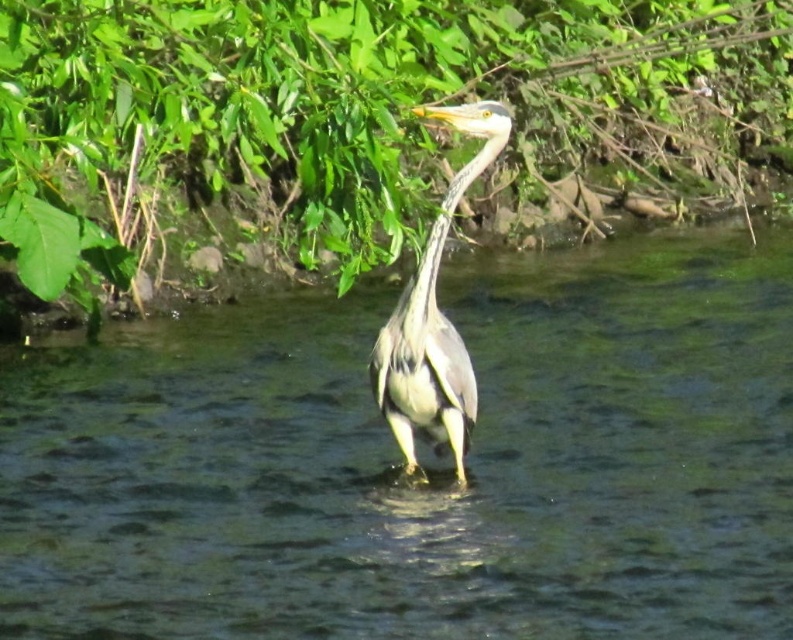
Between green leafy vegetation at upper center and gray matte heron at center, which one is positioned lower?

gray matte heron at center is below.

Can you confirm if green leafy vegetation at upper center is thinner than gray matte heron at center?

In fact, green leafy vegetation at upper center might be wider than gray matte heron at center.

Between point (246, 225) and point (454, 355), which one is positioned in front?

Point (454, 355) is more forward.

This screenshot has height=640, width=793. In order to click on green leafy vegetation at upper center in this screenshot , I will do `click(358, 120)`.

Between green leafy vegetation at upper center and gray matte neck at upper center, which one has less height?

gray matte neck at upper center is shorter.

Is green leafy vegetation at upper center above gray matte neck at upper center?

Yes.

Which is behind, point (389, 173) or point (443, 236)?

Point (389, 173)

The height and width of the screenshot is (640, 793). In order to click on green leafy vegetation at upper center in this screenshot , I will do `click(358, 120)`.

Can you confirm if clear water at center is positioned below gray matte neck at upper center?

Indeed, clear water at center is positioned under gray matte neck at upper center.

Which is above, clear water at center or gray matte neck at upper center?

Positioned higher is gray matte neck at upper center.

Does point (60, 573) come in front of point (427, 308)?

No, it is behind (427, 308).

Locate an element on the screen. Image resolution: width=793 pixels, height=640 pixels. clear water at center is located at coordinates (424, 461).